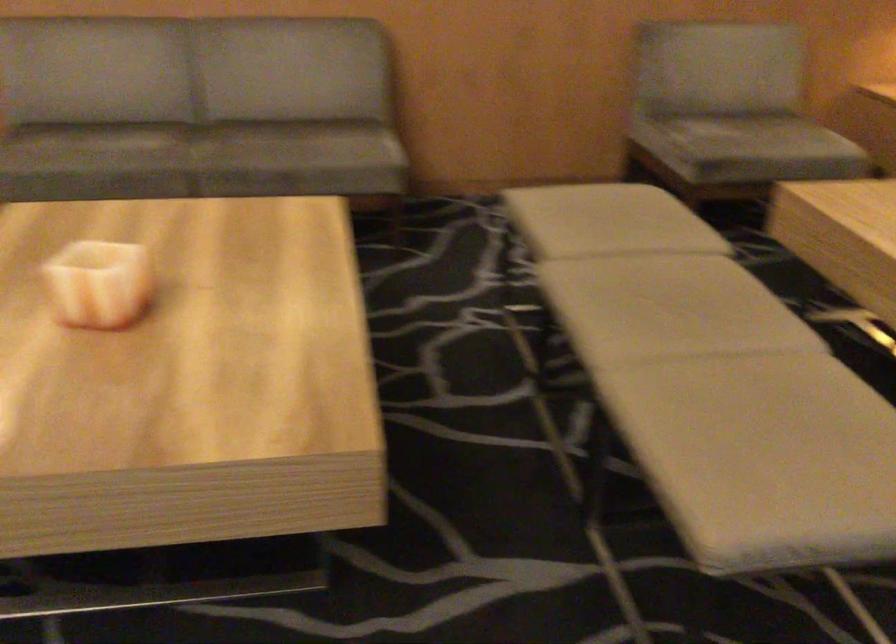
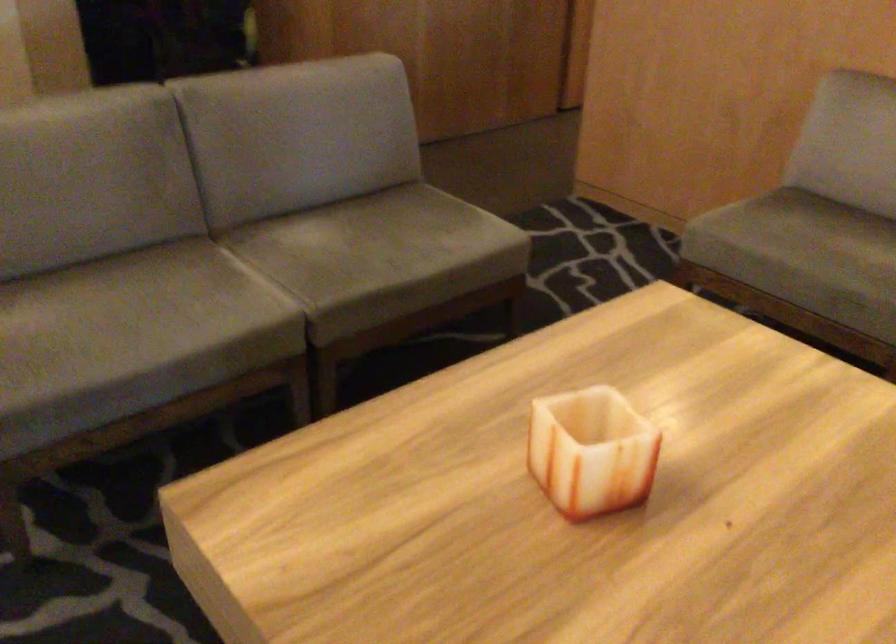
The point at (72,149) is marked in the first image. Where is the corresponding point in the second image?

(798, 245)